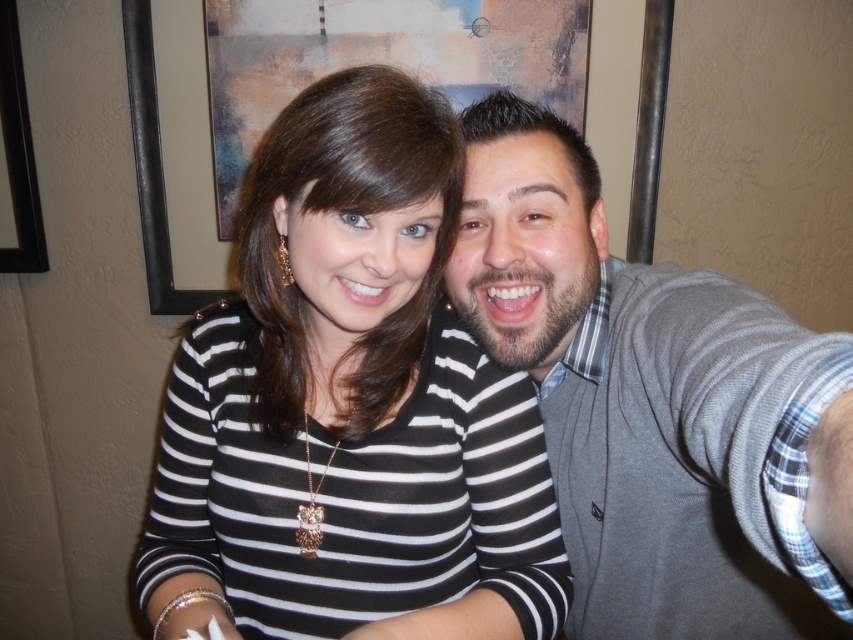
Question: Does black striped shirt at center have a lesser width compared to gray sweater at right?

Choices:
 (A) no
 (B) yes

Answer: (B)

Question: Which point is farther from the camera taking this photo?

Choices:
 (A) click(x=595, y=444)
 (B) click(x=297, y=336)

Answer: (A)

Question: Which object is closer to the camera taking this photo?

Choices:
 (A) gray sweater at right
 (B) black striped shirt at center

Answer: (A)

Question: Which point is farther from the camera taking this photo?

Choices:
 (A) (447, 157)
 (B) (820, 532)

Answer: (A)

Question: Can you confirm if black striped shirt at center is positioned to the left of gray sweater at right?

Choices:
 (A) yes
 (B) no

Answer: (A)

Question: Can you confirm if black striped shirt at center is positioned above gray sweater at right?

Choices:
 (A) yes
 (B) no

Answer: (B)